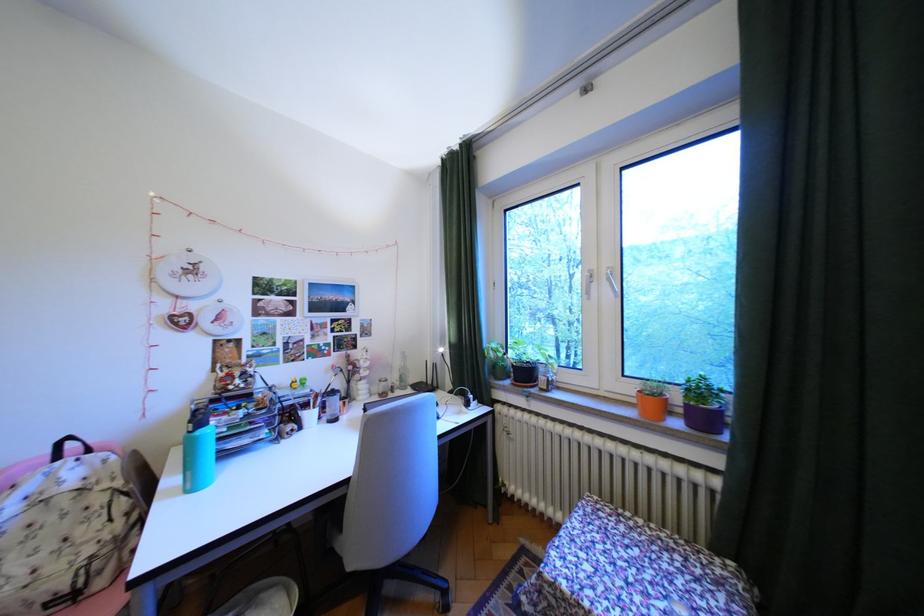
In order to click on white window handle in this screenshot , I will do `click(614, 282)`.